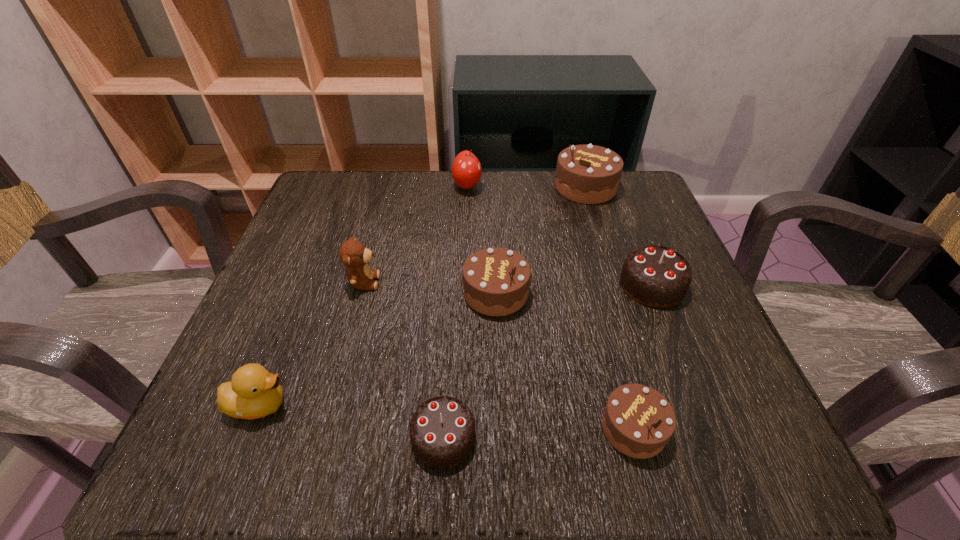
Find the location of a particular element. This screenshot has height=540, width=960. vacant space at the near edge is located at coordinates click(459, 464).

In the image, there is a desktop. What are the coordinates of `vacant area at the left edge` in the screenshot? It's located at click(314, 379).

Where is `vacant area at the right edge of the desktop`? vacant area at the right edge of the desktop is located at coordinates (625, 258).

You are a GUI agent. You are given a task and a screenshot of the screen. Output one action in this format:
    pyautogui.click(x=<x>, y=<y>)
    Task: Click on the blank space at the far left corner of the desktop
    The image size is (960, 540).
    Given the screenshot: What is the action you would take?
    pyautogui.click(x=315, y=212)

This screenshot has height=540, width=960. I want to click on vacant area that lies between the bigger chocolate chocolate cake and the left chocolate chocolate cake, so click(548, 361).

The height and width of the screenshot is (540, 960). In order to click on free space between the tallest chocolate cake and the nearest brown chocolate cake in this screenshot , I will do point(610,308).

Locate an element on the screen. This screenshot has height=540, width=960. free space between the teddy bear and the second nearest brown chocolate cake is located at coordinates (430, 287).

The width and height of the screenshot is (960, 540). Identify the location of free area in between the apple and the tallest object. (526, 186).

The width and height of the screenshot is (960, 540). I want to click on free spot between the brown teddy bear and the smallest brown chocolate cake, so click(x=498, y=355).

Locate an element on the screen. vacant region between the duckling and the right chocolate chocolate cake is located at coordinates (456, 345).